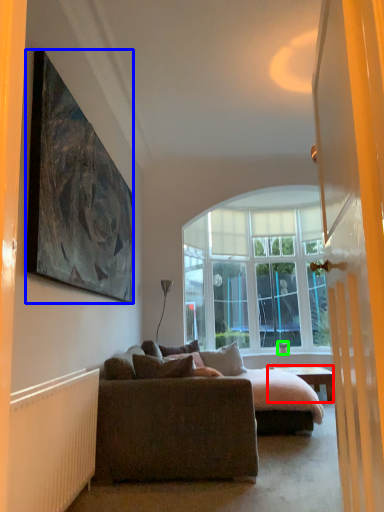
Question: Which object is the closest to the desk (highlighted by a red box)? Choose among these: picture frame (highlighted by a blue box) or houseplant (highlighted by a green box).

Choices:
 (A) picture frame
 (B) houseplant

Answer: (B)